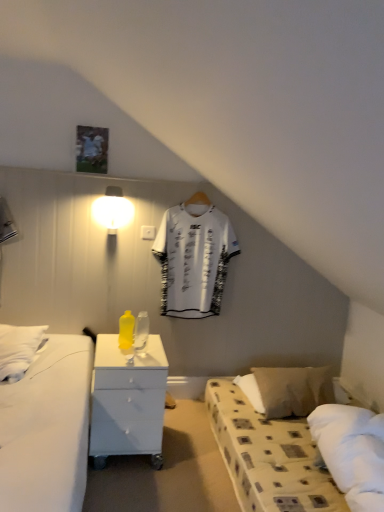
You are a GUI agent. You are given a task and a screenshot of the screen. Output one action in this format:
    pyautogui.click(x=<x>, y=<y>)
    Task: Click on the beige fabric pillow at lower right
    The height and width of the screenshot is (512, 384).
    Given the screenshot: What is the action you would take?
    pyautogui.click(x=293, y=389)

Find the location of a particular element. The width and height of the screenshot is (384, 512). yellow matte bottle at center, marked as the 1th bottle in a left-to-right arrangement is located at coordinates (126, 330).

Is white glossy nightstand at center in contact with transparent glass bottle at center, marked as the 2th bottle in a left-to-right arrangement?

No, white glossy nightstand at center is not touching transparent glass bottle at center, marked as the 2th bottle in a left-to-right arrangement.

From the image's perspective, relative to transparent glass bottle at center, acting as the 1th bottle starting from the right, is white glossy nightstand at center above or below?

Based on their image positions, white glossy nightstand at center is located beneath transparent glass bottle at center, acting as the 1th bottle starting from the right.

From a real-world perspective, is white glossy nightstand at center above or below transparent glass bottle at center, marked as the 2th bottle in a left-to-right arrangement?

white glossy nightstand at center is situated lower than transparent glass bottle at center, marked as the 2th bottle in a left-to-right arrangement, in the real world.

In the scene shown: Which is behind, transparent glass bottle at center, acting as the 1th bottle starting from the right, or beige fabric pillow at lower right?

Positioned behind is beige fabric pillow at lower right.

Is beige fabric pillow at lower right at the back of transparent glass bottle at center, marked as the 2th bottle in a left-to-right arrangement?

transparent glass bottle at center, marked as the 2th bottle in a left-to-right arrangement, is not turned away from beige fabric pillow at lower right.

From a real-world perspective, is transparent glass bottle at center, marked as the 2th bottle in a left-to-right arrangement, beneath beige fabric pillow at lower right?

No, from a real-world perspective, transparent glass bottle at center, marked as the 2th bottle in a left-to-right arrangement, is not beneath beige fabric pillow at lower right.

From a real-world perspective, between beige fabric pillow at lower right and white jersey at center, who is vertically higher?

In real-world perspective, white jersey at center is above.

How different are the orientations of beige fabric pillow at lower right and white jersey at center in degrees?

beige fabric pillow at lower right and white jersey at center are facing 1.2 degrees away from each other.

Considering the sizes of beige fabric pillow at lower right and white jersey at center in the image, is beige fabric pillow at lower right wider or thinner than white jersey at center?

In the image, beige fabric pillow at lower right appears to be wider than white jersey at center.

From the image's perspective, which is below, beige fabric pillow at lower right or white jersey at center?

beige fabric pillow at lower right.

Is white jersey at center inside transparent glass bottle at center, marked as the 2th bottle in a left-to-right arrangement?

No, transparent glass bottle at center, marked as the 2th bottle in a left-to-right arrangement, does not contain white jersey at center.

In terms of height, does transparent glass bottle at center, acting as the 1th bottle starting from the right, look taller or shorter compared to white jersey at center?

transparent glass bottle at center, acting as the 1th bottle starting from the right, is shorter than white jersey at center.

From a real-world perspective, who is located higher, transparent glass bottle at center, acting as the 1th bottle starting from the right, or white jersey at center?

From a 3D spatial view, white jersey at center is above.

Which is more to the right, transparent glass bottle at center, marked as the 2th bottle in a left-to-right arrangement, or white jersey at center?

From the viewer's perspective, white jersey at center appears more on the right side.

Is white jersey at center directly adjacent to white glossy wall lamp at upper left?

white jersey at center and white glossy wall lamp at upper left are clearly separated.

In the image, is white jersey at center on the left side or the right side of white glossy wall lamp at upper left?

white jersey at center is positioned on white glossy wall lamp at upper left's right side.

Which of these two, white jersey at center or white glossy wall lamp at upper left, is bigger?

With larger size is white jersey at center.

Is white glossy wall lamp at upper left surrounded by white jersey at center?

No, white glossy wall lamp at upper left is not inside white jersey at center.

Considering the positions of objects beige fabric pillow at lower right and white glossy wall lamp at upper left in the image provided, who is more to the left, beige fabric pillow at lower right or white glossy wall lamp at upper left?

white glossy wall lamp at upper left.

Is beige fabric pillow at lower right taller than white glossy wall lamp at upper left?

No.

From a real-world perspective, relative to white glossy wall lamp at upper left, is beige fabric pillow at lower right vertically above or below?

In terms of real-world spatial position, beige fabric pillow at lower right is below white glossy wall lamp at upper left.

Is transparent glass bottle at center, acting as the 1th bottle starting from the right, spatially inside yellow matte bottle at center, which appears as the second bottle when viewed from the right, or outside of it?

transparent glass bottle at center, acting as the 1th bottle starting from the right, lies outside yellow matte bottle at center, which appears as the second bottle when viewed from the right.

From a real-world perspective, who is located lower, transparent glass bottle at center, acting as the 1th bottle starting from the right, or yellow matte bottle at center, which appears as the second bottle when viewed from the right?

yellow matte bottle at center, which appears as the second bottle when viewed from the right.

How many degrees apart are the facing directions of transparent glass bottle at center, marked as the 2th bottle in a left-to-right arrangement, and yellow matte bottle at center, which appears as the second bottle when viewed from the right?

transparent glass bottle at center, marked as the 2th bottle in a left-to-right arrangement, and yellow matte bottle at center, which appears as the second bottle when viewed from the right, are facing 0.000441 degrees away from each other.

Is transparent glass bottle at center, acting as the 1th bottle starting from the right, closer to camera compared to yellow matte bottle at center, which appears as the second bottle when viewed from the right?

Yes, the depth of transparent glass bottle at center, acting as the 1th bottle starting from the right, is less than that of yellow matte bottle at center, which appears as the second bottle when viewed from the right.

What are the coordinates of `nightstand that is on the left side of transparent glass bottle at center, acting as the 1th bottle starting from the right` in the screenshot? It's located at (127, 401).

Identify the location of pillow below the transparent glass bottle at center, marked as the 2th bottle in a left-to-right arrangement (from the image's perspective). (293, 389).

When comparing their distances from white jersey at center, does white glossy nightstand at center or yellow matte bottle at center, marked as the 1th bottle in a left-to-right arrangement, seem further?

The object further to white jersey at center is white glossy nightstand at center.

Based on their spatial positions, is white jersey at center or transparent glass bottle at center, marked as the 2th bottle in a left-to-right arrangement, closer to white glossy nightstand at center?

Based on the image, transparent glass bottle at center, marked as the 2th bottle in a left-to-right arrangement, appears to be nearer to white glossy nightstand at center.

Which object lies nearer to the anchor point white glossy wall lamp at upper left, transparent glass bottle at center, marked as the 2th bottle in a left-to-right arrangement, or white jersey at center?

white jersey at center is positioned closer to the anchor white glossy wall lamp at upper left.

When comparing their distances from white glossy nightstand at center, does yellow matte bottle at center, which appears as the second bottle when viewed from the right, or transparent glass bottle at center, marked as the 2th bottle in a left-to-right arrangement, seem further?

transparent glass bottle at center, marked as the 2th bottle in a left-to-right arrangement, is positioned further to the anchor white glossy nightstand at center.

From the image, which object appears to be farther from beige fabric pillow at lower right, white glossy wall lamp at upper left or white glossy nightstand at center?

The object further to beige fabric pillow at lower right is white glossy wall lamp at upper left.

From the image, which object appears to be farther from white glossy nightstand at center, beige fabric pillow at lower right or transparent glass bottle at center, marked as the 2th bottle in a left-to-right arrangement?

The object further to white glossy nightstand at center is beige fabric pillow at lower right.

Considering their positions, is white jersey at center positioned closer to beige fabric pillow at lower right than transparent glass bottle at center, marked as the 2th bottle in a left-to-right arrangement?

white jersey at center.

Which object lies nearer to the anchor point beige fabric pillow at lower right, transparent glass bottle at center, marked as the 2th bottle in a left-to-right arrangement, or white glossy wall lamp at upper left?

transparent glass bottle at center, marked as the 2th bottle in a left-to-right arrangement, is closer to beige fabric pillow at lower right.

At what (x,y) coordinates should I click in order to perform the action: click on clothing between white glossy nightstand at center and beige fabric pillow at lower right in the horizontal direction. Please return your answer as a coordinate pair (x, y). The height and width of the screenshot is (512, 384). Looking at the image, I should click on (194, 257).

I want to click on clothing that lies between white glossy wall lamp at upper left and beige fabric pillow at lower right from top to bottom, so click(x=194, y=257).

Where is `bottle between transparent glass bottle at center, acting as the 1th bottle starting from the right, and white glossy nightstand at center vertically`? bottle between transparent glass bottle at center, acting as the 1th bottle starting from the right, and white glossy nightstand at center vertically is located at coordinates (126, 330).

Locate an element on the screen. The height and width of the screenshot is (512, 384). clothing between yellow matte bottle at center, marked as the 1th bottle in a left-to-right arrangement, and beige fabric pillow at lower right is located at coordinates (194, 257).